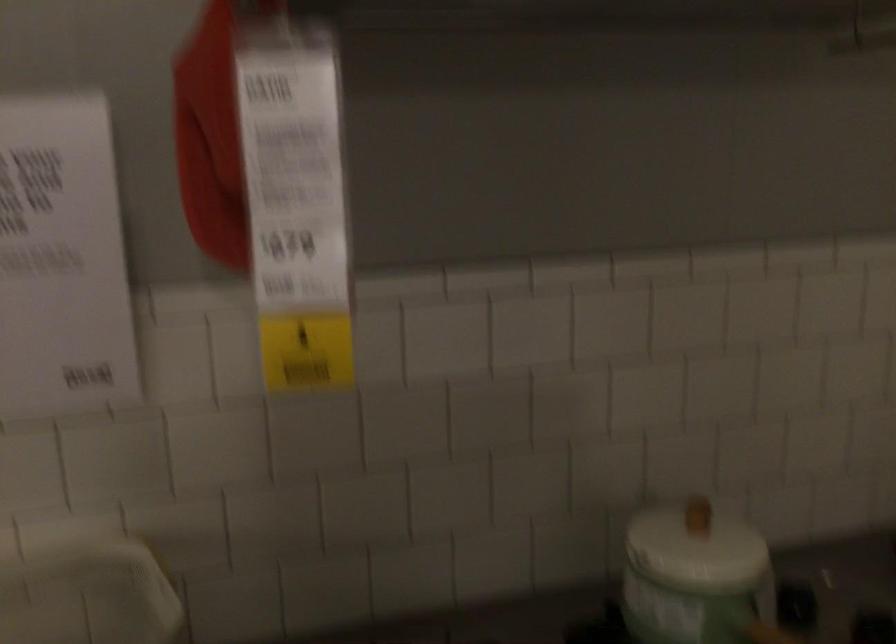
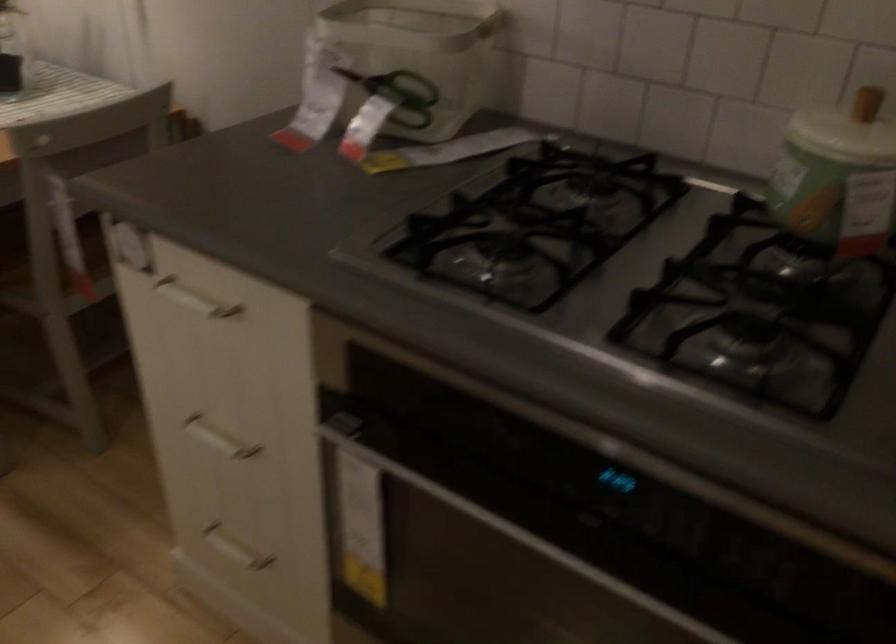
Find the pixel in the second image that matches [700,532] in the first image.

(866, 102)